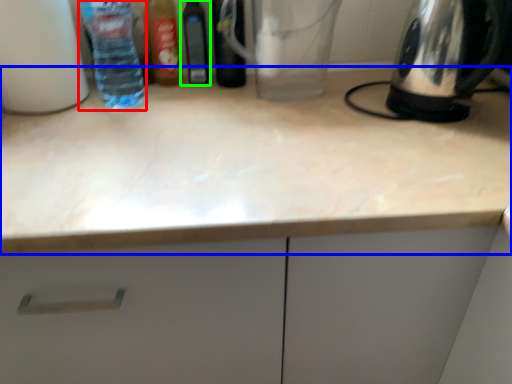
Question: Which object is positioned closest to bottle (highlighted by a red box)? Select from countertop (highlighted by a blue box) and bottle (highlighted by a green box).

Choices:
 (A) countertop
 (B) bottle

Answer: (B)